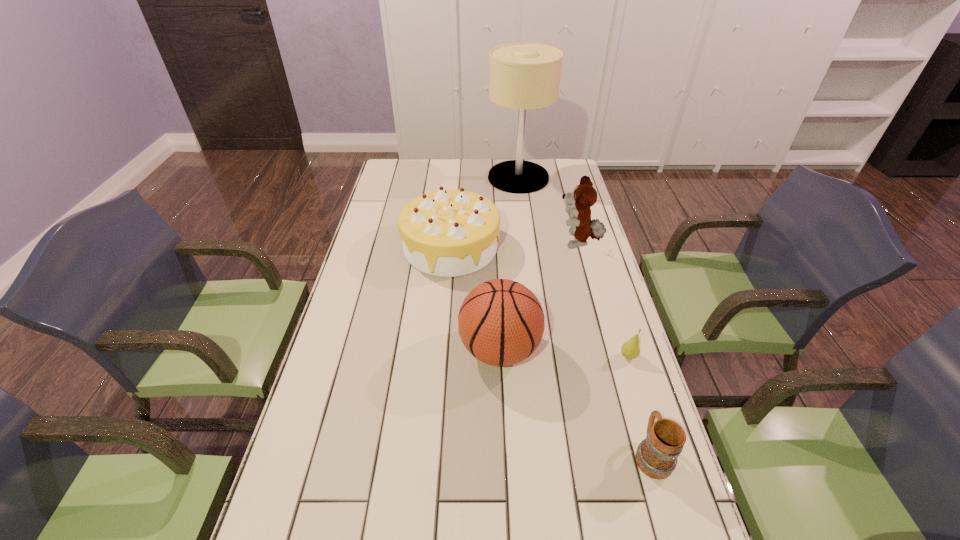
You are a GUI agent. You are given a task and a screenshot of the screen. Output one action in this format:
    pyautogui.click(x=<x>, y=<y>)
    Task: Click on the object at the far edge
    Image resolution: width=960 pixels, height=540 pixels.
    Given the screenshot: What is the action you would take?
    pyautogui.click(x=522, y=76)

I want to click on object that is positioned at the left edge, so click(448, 233).

Where is `table lamp that is at the right edge`? This screenshot has height=540, width=960. table lamp that is at the right edge is located at coordinates (522, 76).

This screenshot has height=540, width=960. Identify the location of puppy that is at the right edge. (584, 196).

Find the location of a particular element. Image resolution: width=960 pixels, height=540 pixels. mug that is at the right edge is located at coordinates (656, 456).

At what (x,y) coordinates should I click in order to perform the action: click on pear situated at the right edge. Please return your answer as a coordinate pair (x, y). This screenshot has width=960, height=540. Looking at the image, I should click on (630, 349).

Where is `object present at the far right corner`? The image size is (960, 540). object present at the far right corner is located at coordinates (522, 76).

Locate an element on the screen. Image resolution: width=960 pixels, height=540 pixels. vacant space at the left edge of the desktop is located at coordinates (289, 470).

The height and width of the screenshot is (540, 960). Identify the location of vacant space at the right edge. (610, 377).

Find the location of a particular element. This screenshot has width=960, height=540. free space at the far left corner of the desktop is located at coordinates (394, 165).